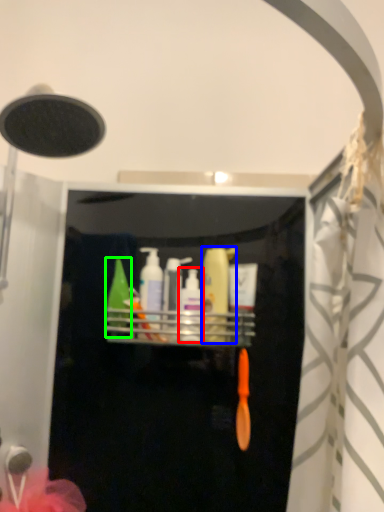
Question: Which object is positioned farthest from toiletry (highlighted by a red box)? Select from toiletry (highlighted by a blue box) and toiletry (highlighted by a green box).

Choices:
 (A) toiletry
 (B) toiletry

Answer: (B)